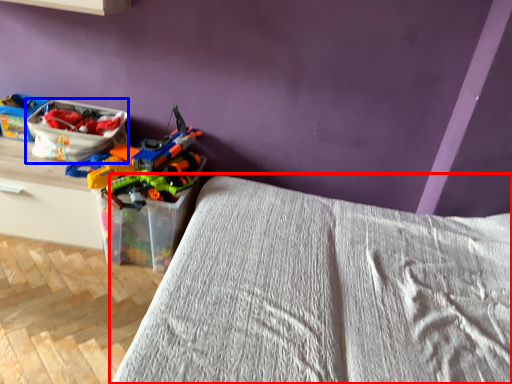
Question: Which of the following is the farthest to the observer, bed (highlighted by a red box) or kit (highlighted by a blue box)?

Choices:
 (A) bed
 (B) kit

Answer: (B)